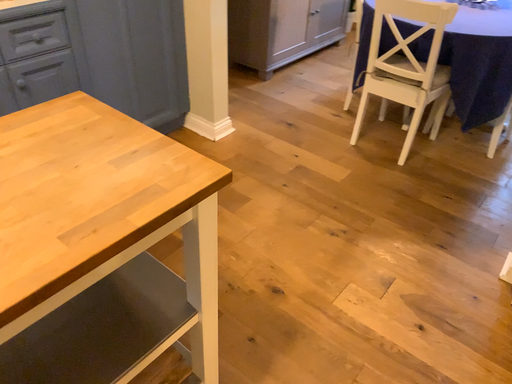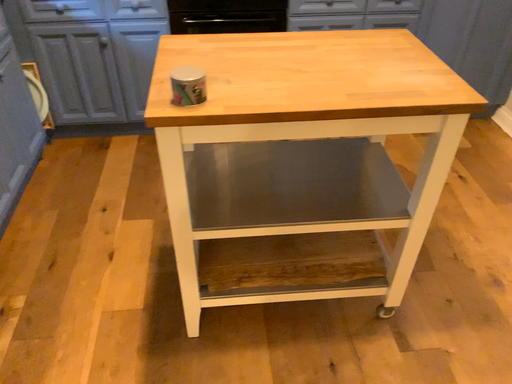
Question: How did the camera likely rotate when shooting the video?

Choices:
 (A) rotated right
 (B) rotated left

Answer: (B)